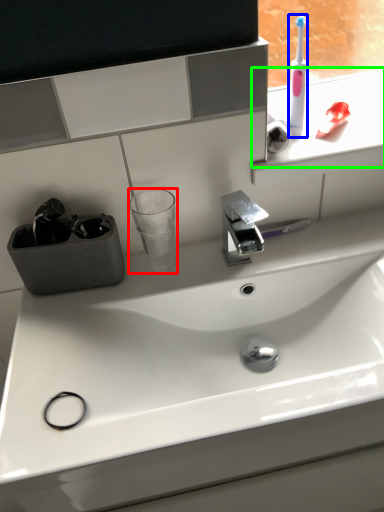
Question: Which object is positioned farthest from shot glass (highlighted by a red box)? Select from toothbrush (highlighted by a blue box) and window sill (highlighted by a green box).

Choices:
 (A) toothbrush
 (B) window sill

Answer: (B)